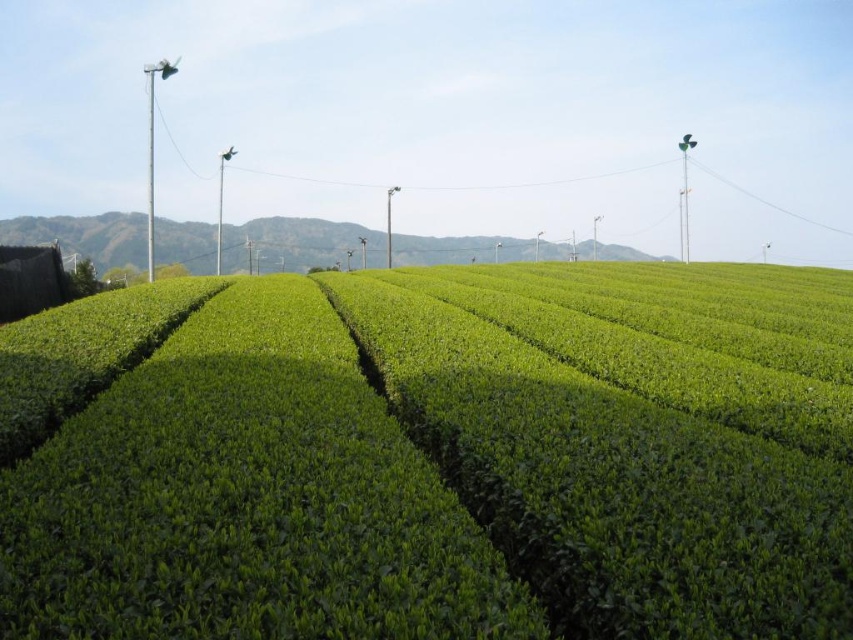
You are a farmer planning to install a new irrigation system. You need to decide whether to place it on the green leafy field at center or the green grassy hill at center. Which location is lower in elevation?

The green leafy field at center is located below green grassy hill at center, so it is lower in elevation. Therefore, the irrigation system should be placed on the green leafy field at center.

You are a farmer planning to plant new tea bushes. You have two areas available in the image, the green leafy field at center and the green grassy hill at center. Which area has a larger space for planting more tea bushes?

The green grassy hill at center is larger than the green leafy field at center, so it has more space for planting more tea bushes.